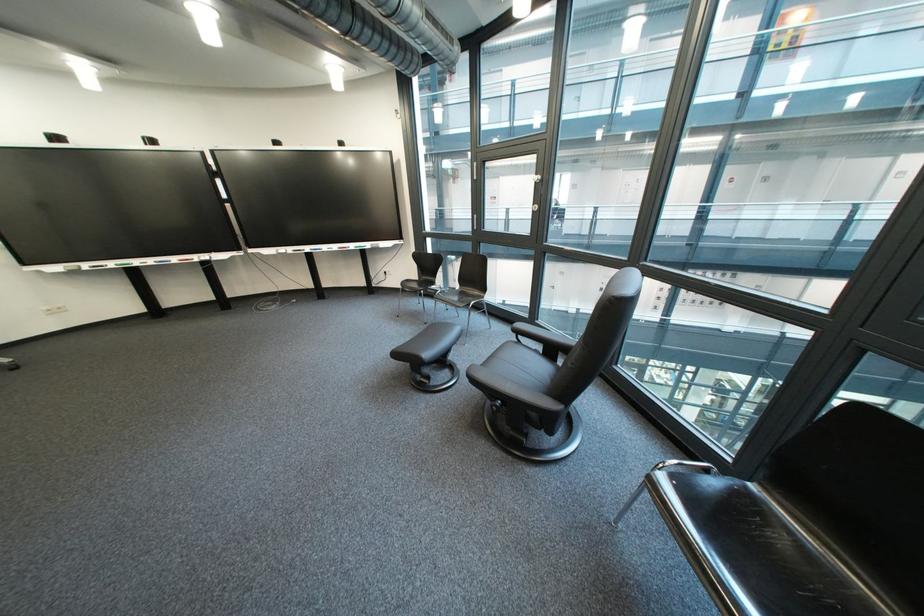
The image size is (924, 616). What do you see at coordinates (589, 488) in the screenshot?
I see `the metal door handle` at bounding box center [589, 488].